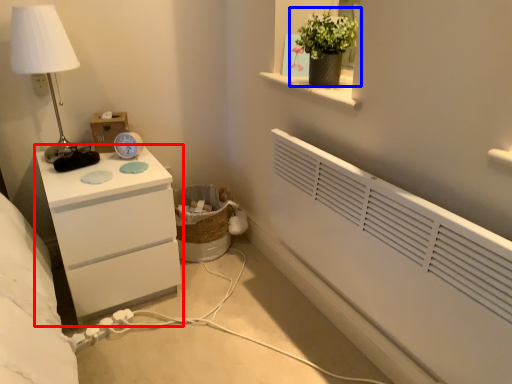
Question: Which object appears closest to the camera in this image, chest of drawers (highlighted by a red box) or houseplant (highlighted by a blue box)?

Choices:
 (A) chest of drawers
 (B) houseplant

Answer: (B)